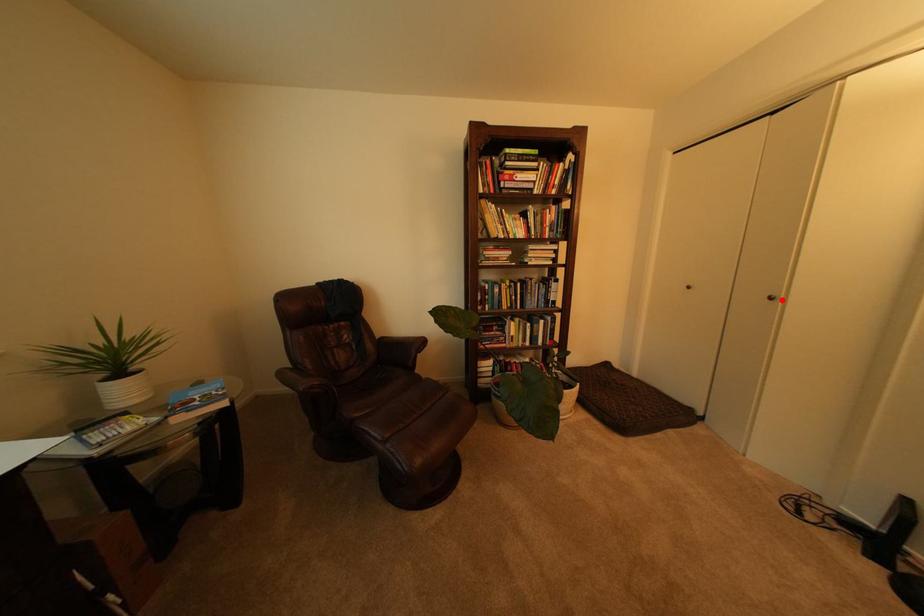
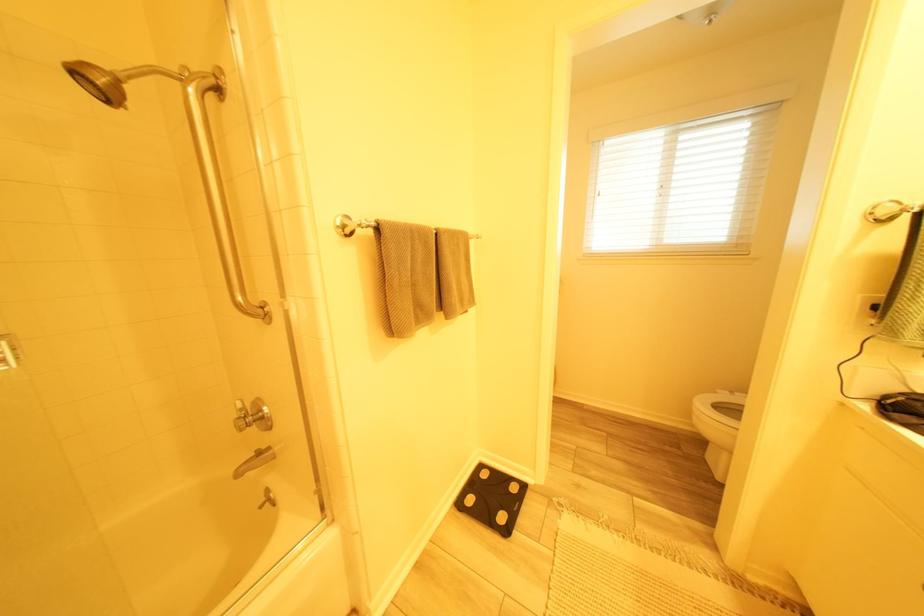
Question: I am providing you with two images of the same scene from different viewpoints. A red point is marked on the first image. Can you still see the location of the red point in image 2?

Choices:
 (A) Yes
 (B) No

Answer: (B)